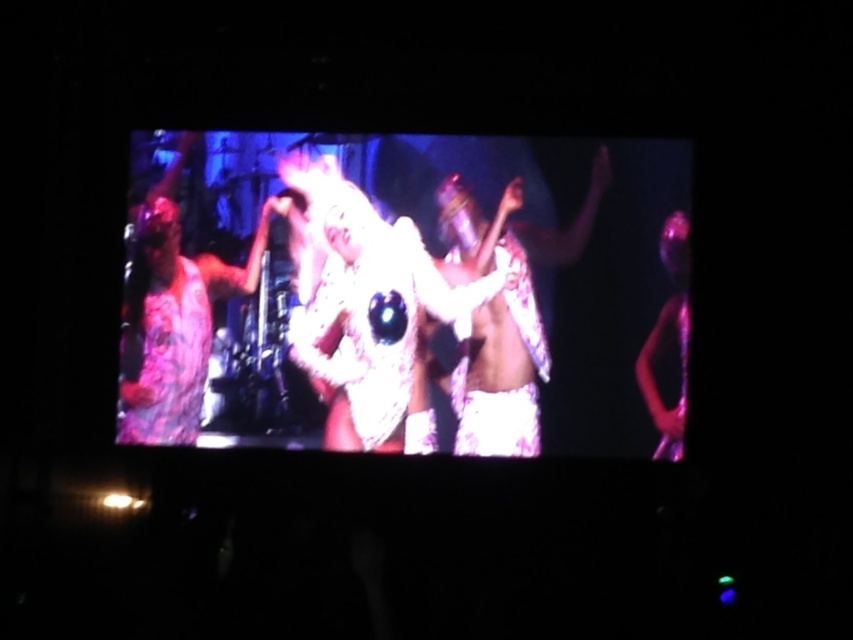
Who is more forward, (306, 237) or (666, 417)?

Point (666, 417) is more forward.

Between white fluffy costume at center and purple iridescent figure at right, which one has more height?

Standing taller between the two is purple iridescent figure at right.

Find the location of `white fluffy costume at center`. white fluffy costume at center is located at coordinates (370, 300).

Where is `white fluffy costume at center`? white fluffy costume at center is located at coordinates (370, 300).